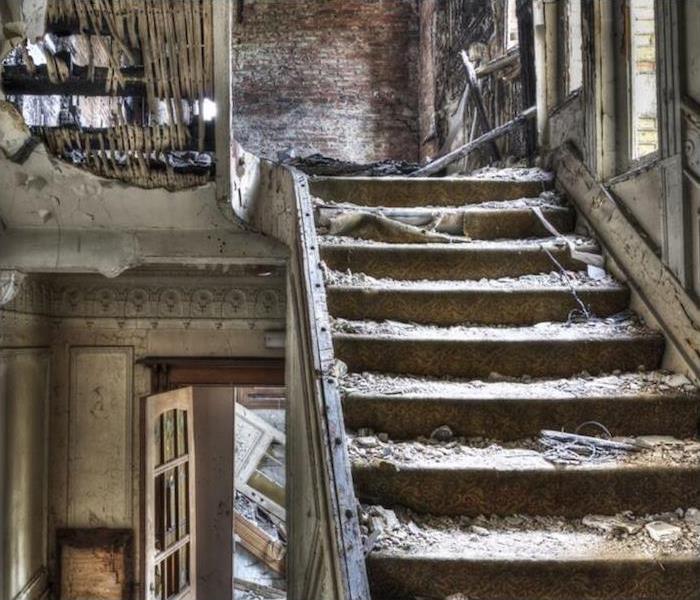
Find the location of a particular element. staircase is located at coordinates (468, 355), (91, 81).